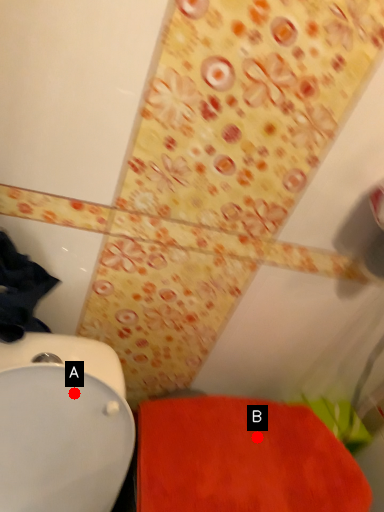
Question: Two points are circled on the image, labeled by A and B beside each circle. Which point is closer to the camera?

Choices:
 (A) A is closer
 (B) B is closer

Answer: (A)